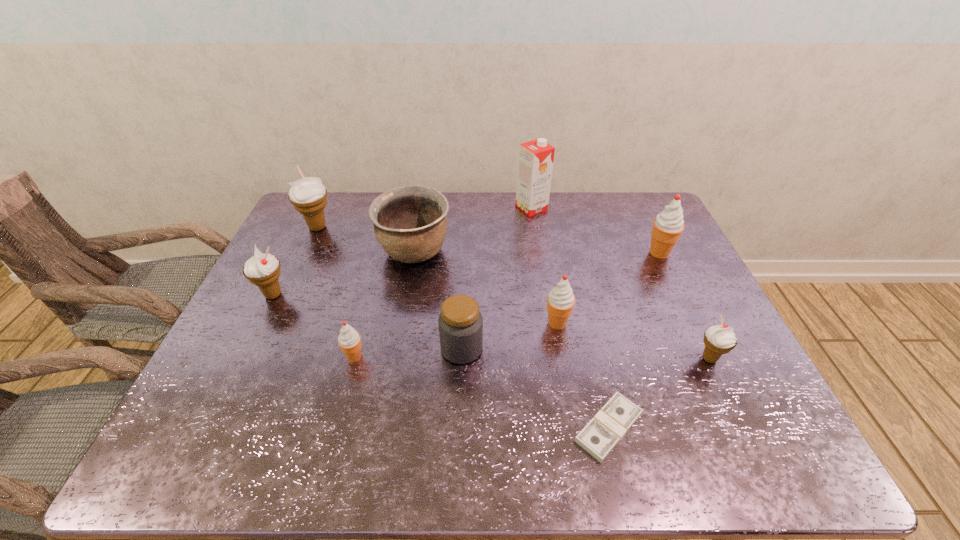
Identify the location of free space located on the front of the rightmost red icecream. (711, 361).

I want to click on free location located on the front of the pottery, so click(x=396, y=356).

The width and height of the screenshot is (960, 540). What are the coordinates of `free location located 0.210m on the front of the sixth nearest object` in the screenshot? It's located at (235, 370).

Identify the location of vacant space situated on the left of the third nearest icecream. (410, 323).

The image size is (960, 540). What are the coordinates of `vacant space situated on the surface of the jar near the warning symbol` in the screenshot? It's located at (571, 348).

Where is `free space located 0.050m on the left of the nearest red icecream`? free space located 0.050m on the left of the nearest red icecream is located at coordinates (323, 357).

This screenshot has height=540, width=960. In order to click on vacant space located on the left of the rightmost white icecream in this screenshot , I will do `click(629, 359)`.

The image size is (960, 540). I want to click on free space located on the left of the nearest object, so click(449, 428).

You are a GUI agent. You are given a task and a screenshot of the screen. Output one action in this format:
    pyautogui.click(x=<x>, y=<y>)
    Task: Click on the carton that is positioned at the far edge
    This screenshot has height=540, width=960.
    Given the screenshot: What is the action you would take?
    pyautogui.click(x=535, y=159)

The height and width of the screenshot is (540, 960). What are the coordinates of `icecream at the far edge` in the screenshot? It's located at pos(308,195).